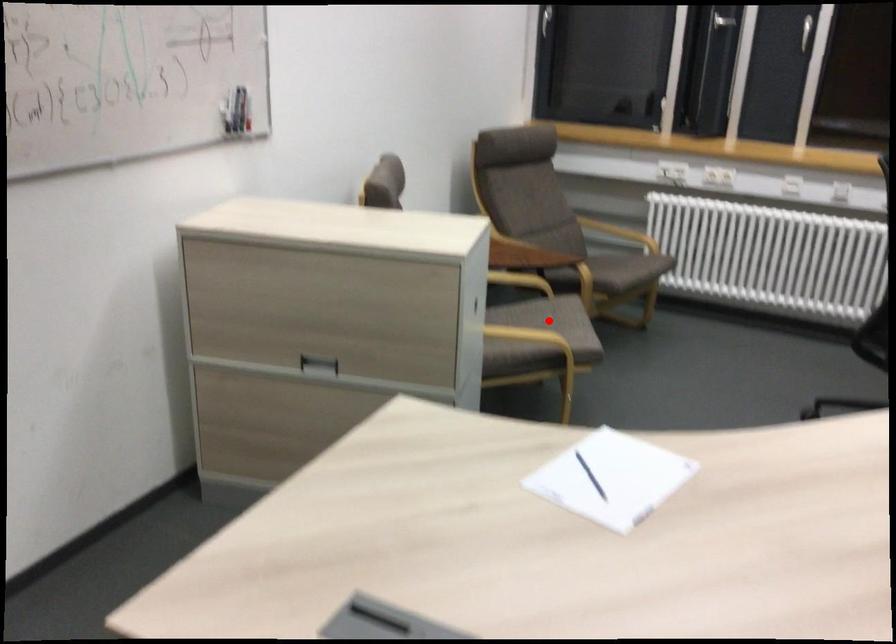
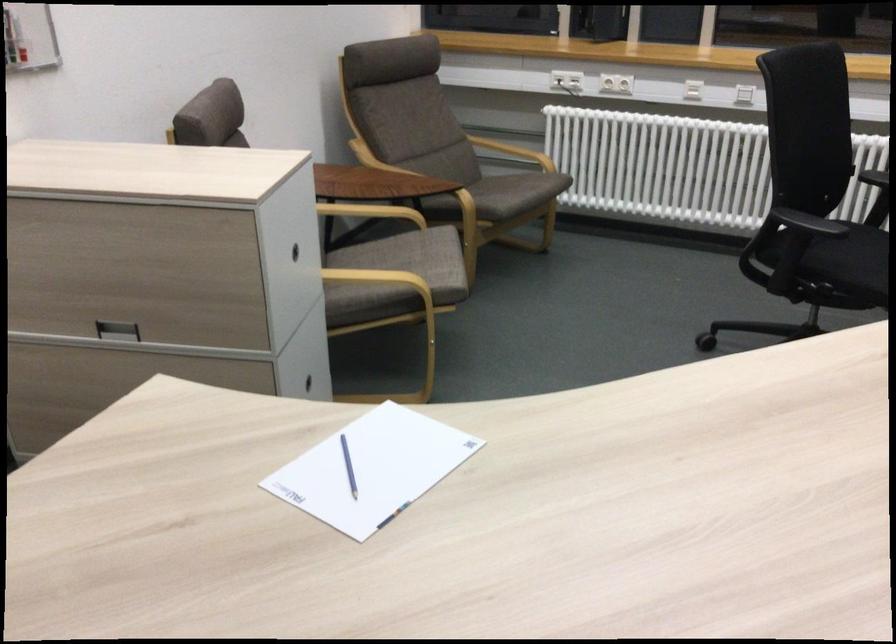
In the second image, find the point that corresponds to the highlighted location in the first image.

(412, 259)